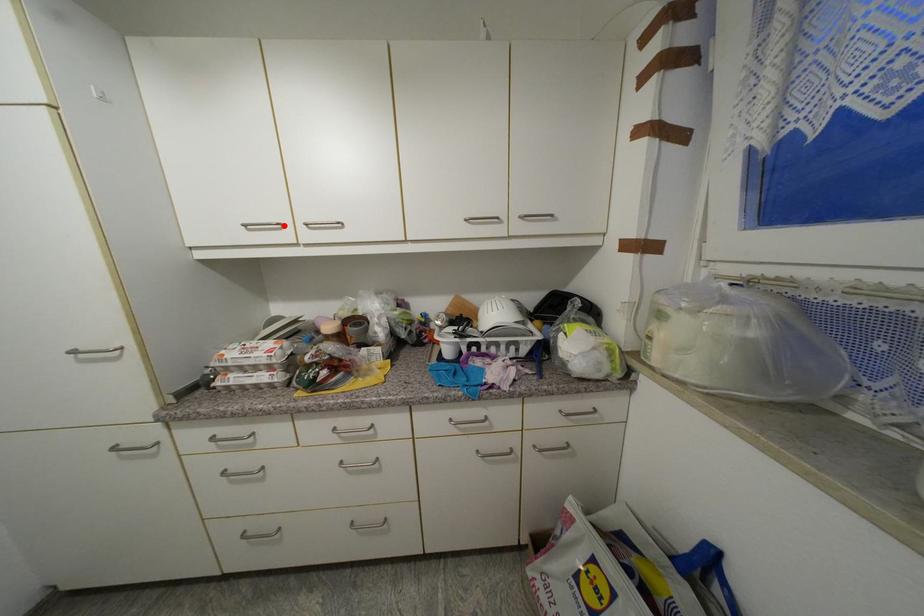
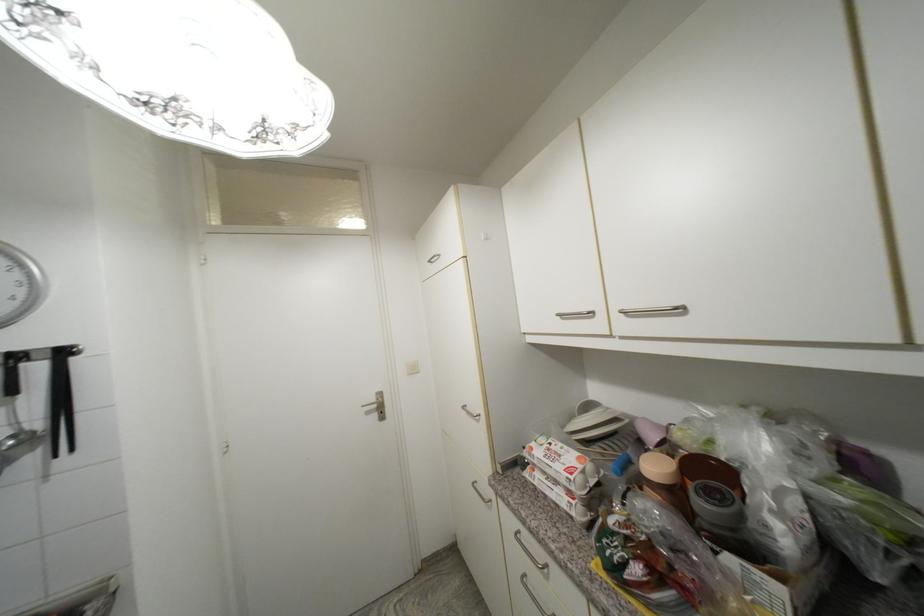
Find the pixel in the second image that matches the highlighted location in the first image.

(594, 314)